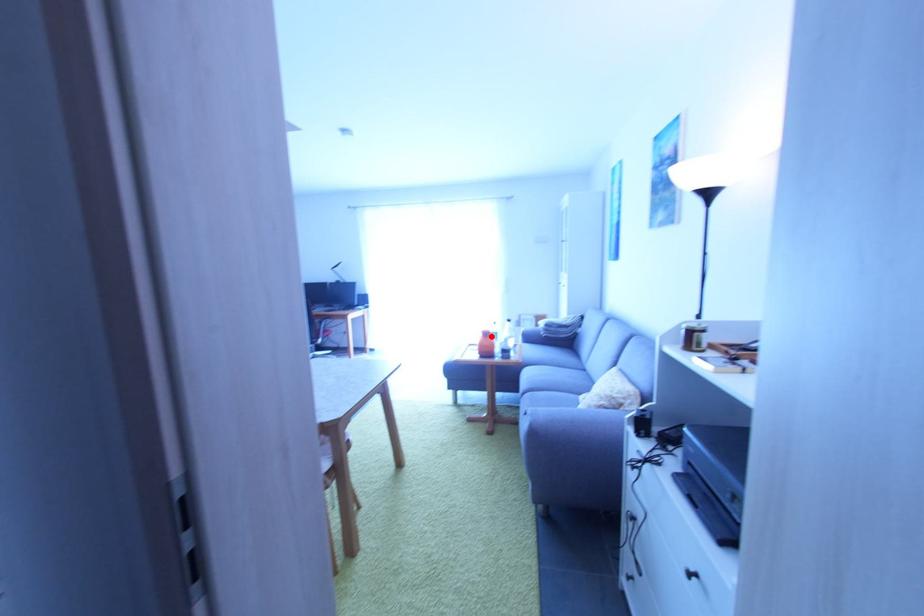
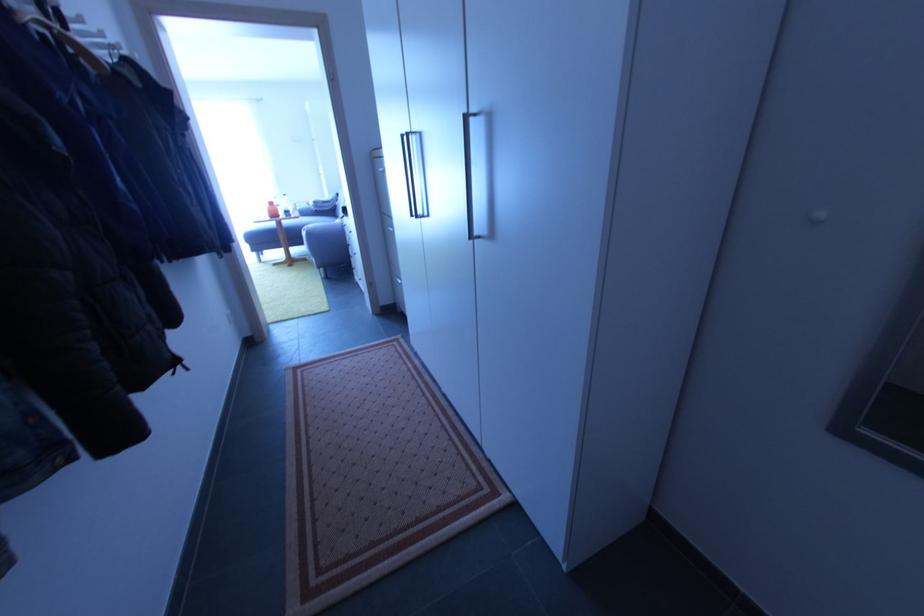
Locate, in the second image, the point that corresponds to the highlighted location in the first image.

(275, 205)